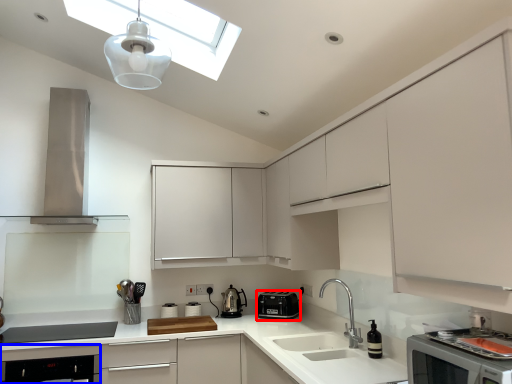
Question: Which of the following is the closest to the observer, kitchen appliance (highlighted by a red box) or dish washer (highlighted by a blue box)?

Choices:
 (A) kitchen appliance
 (B) dish washer

Answer: (B)